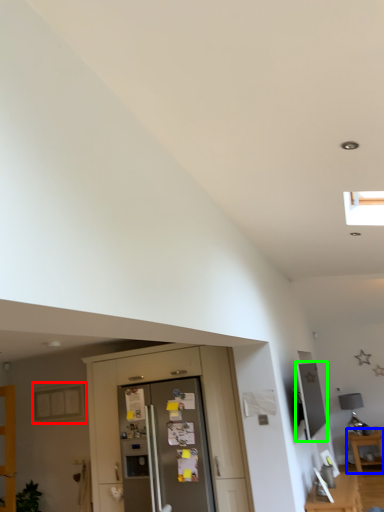
Question: Which is nearer to the window (highlighted by a red box)? table (highlighted by a blue box) or appliance (highlighted by a green box).

Choices:
 (A) table
 (B) appliance

Answer: (B)